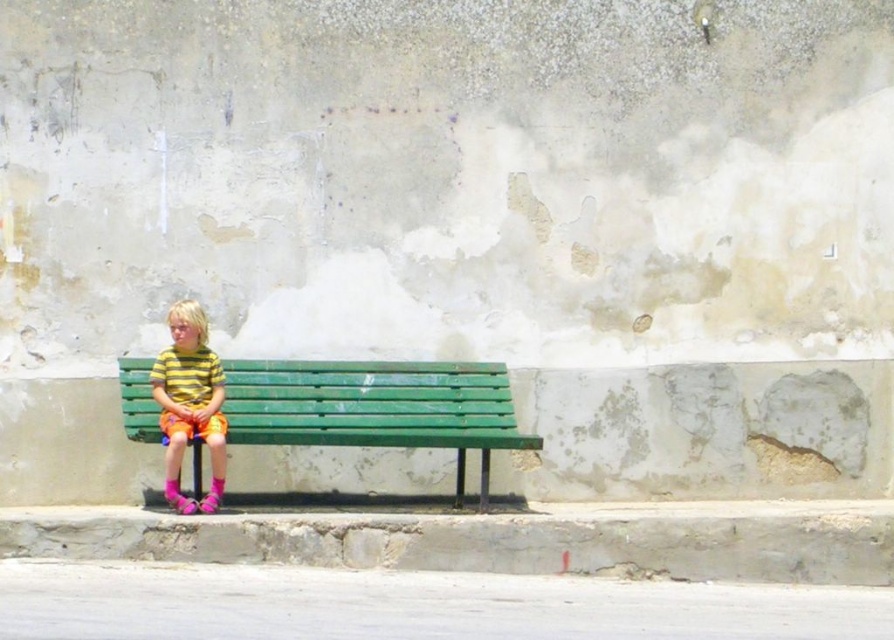
You are standing at the origin point of the coordinate system in the image. You want to move towards the green painted wood bench at center. What are the coordinates you need to move to reach it?

The coordinates to reach the green painted wood bench at center are at point (x=377, y=406).

You are a photographer setting up a shoot in this scene. You need to position a small tripod between the green painted wood bench at center and the striped cotton shirt at center. Based on their positions, which object should the tripod be placed closer to?

The green painted wood bench at center is to the right of the striped cotton shirt at center, so the tripod should be placed closer to the striped cotton shirt at center to be between them.